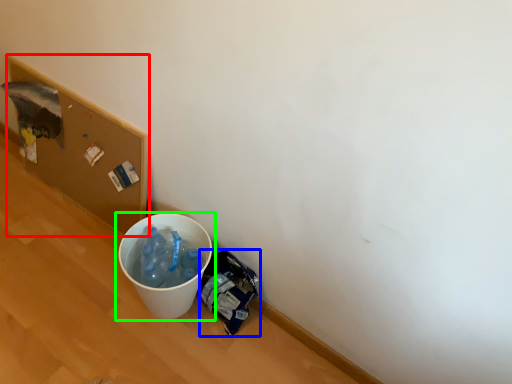
Question: Based on their relative distances, which object is nearer to cardboard box (highlighted by a red box)? Choose from garbage (highlighted by a blue box) and waste container (highlighted by a green box).

Choices:
 (A) garbage
 (B) waste container

Answer: (B)